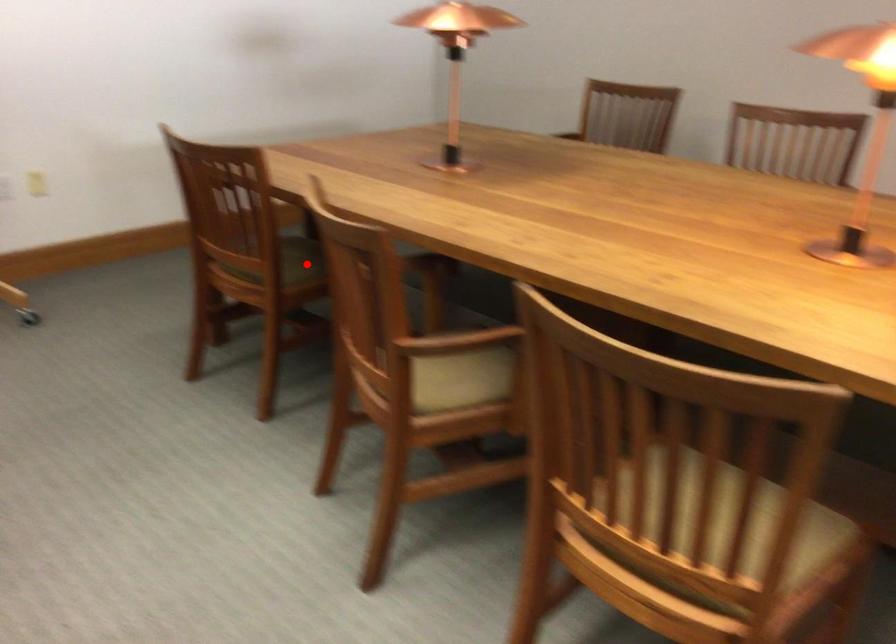
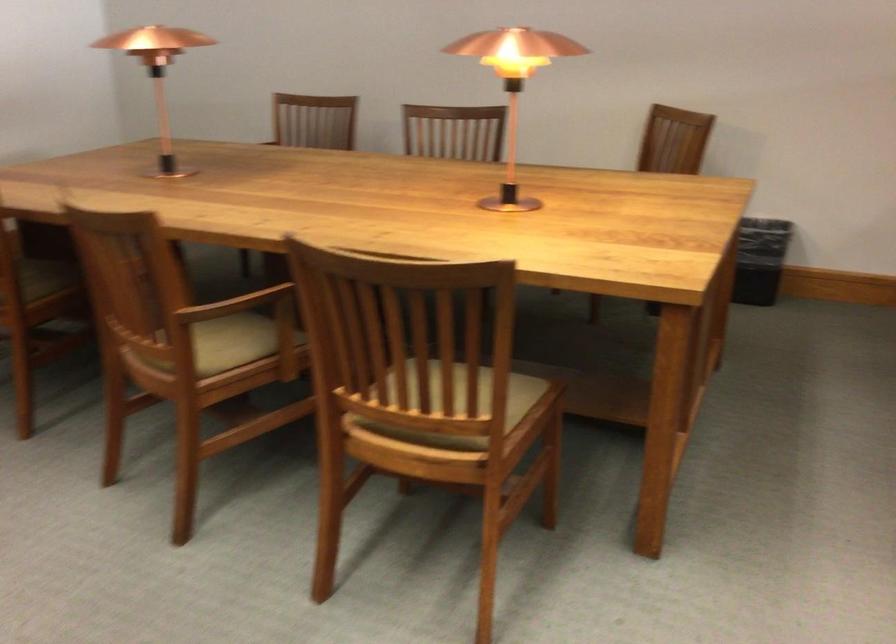
Question: I am providing you with two images of the same scene from different viewpoints. A red point is marked on the first image. Can you still see the location of the red point in image 2?

Choices:
 (A) Yes
 (B) No

Answer: (A)